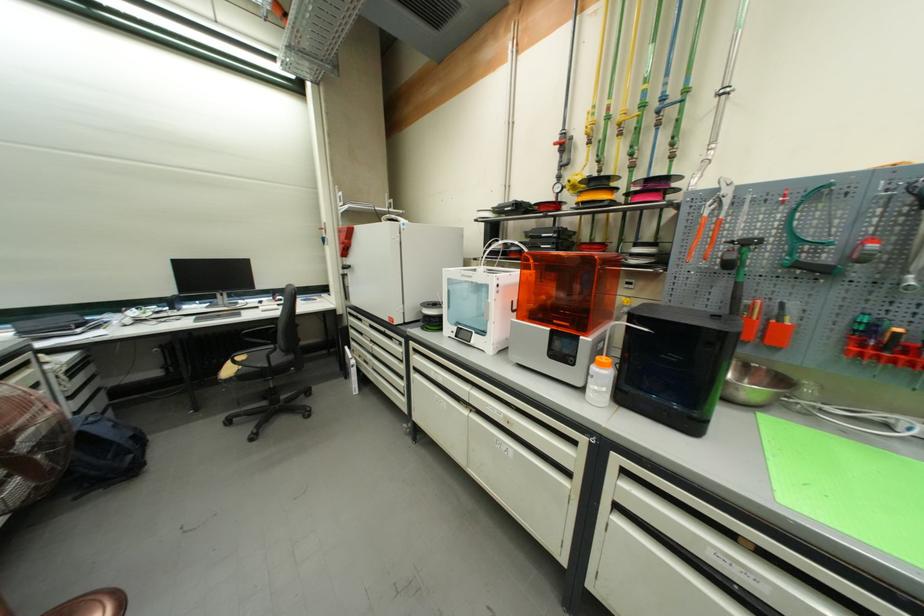
This screenshot has width=924, height=616. What do you see at coordinates (258, 357) in the screenshot? I see `a chair sitting surface` at bounding box center [258, 357].